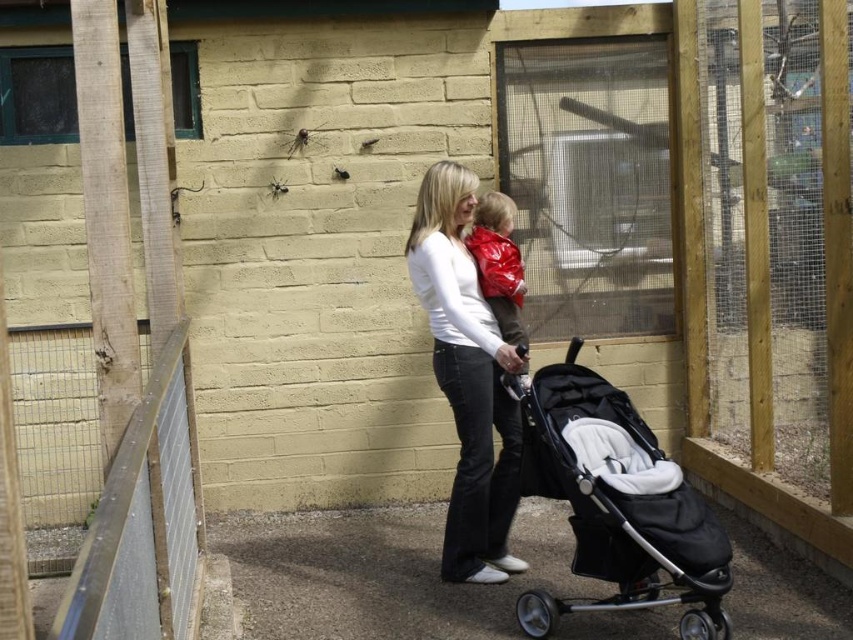
Which object is closer to the clear mesh screen door at center, the woman and child or the black stroller with a white cushioned seat?

The black stroller with a white cushioned seat is closer to the clear mesh screen door at center because it is positioned in front of the woman and child.

You are a parent trying to place a shiny red jacket at center onto the black fabric stroller at lower right. Can the jacket fit over the stroller without any issues?

The black fabric stroller at lower right is taller than the shiny red jacket at center, so the jacket can fit over the stroller without any issues since it is shorter than the stroller.